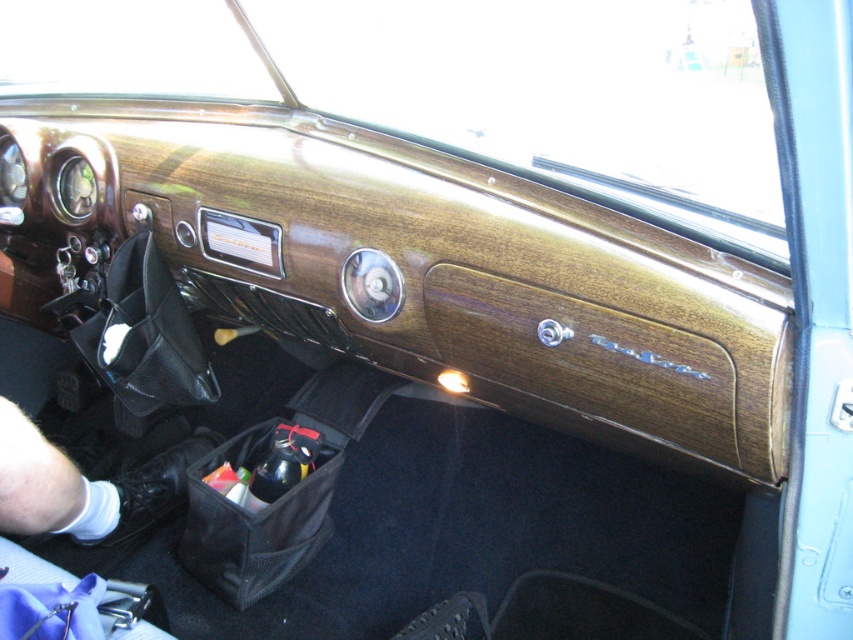
Looking at this image, does black mesh bag at lower center have a lesser width compared to black leather glove at lower left?

Incorrect, black mesh bag at lower center's width is not less than black leather glove at lower left's.

Can you confirm if black mesh bag at lower center is wider than black leather glove at lower left?

Indeed, black mesh bag at lower center has a greater width compared to black leather glove at lower left.

Which is in front, point (212, 547) or point (86, 509)?

Positioned in front is point (86, 509).

Where is `black mesh bag at lower center`? This screenshot has height=640, width=853. black mesh bag at lower center is located at coordinates (254, 522).